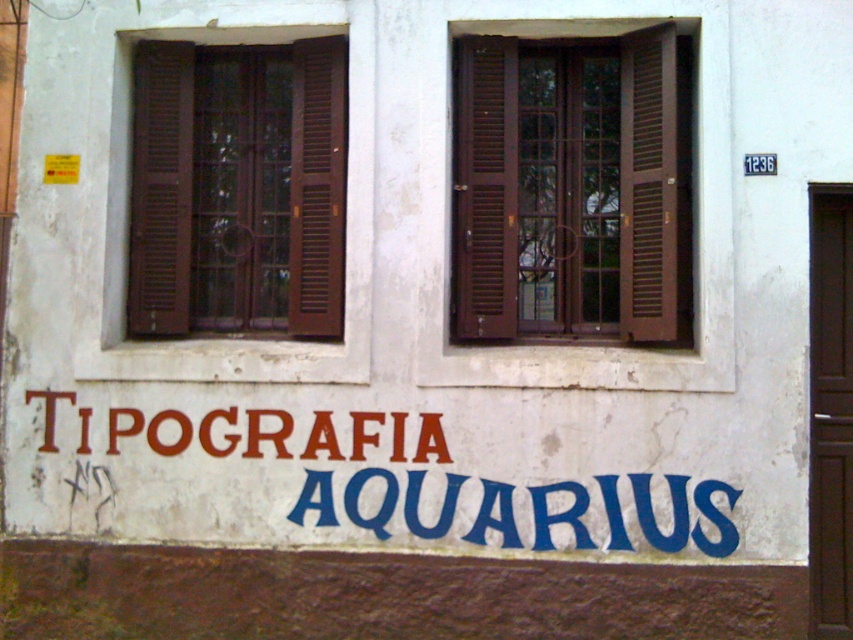
You are standing in front of the building and want to place a sticker on the wall. You have two points marked on your map as coordinates. The first point is at point (x=512, y=252) and the second is at point (x=608, y=496). If you want to place the sticker where it will be visible from the front without being blocked by the other point, which coordinate should you choose?

You should choose point (x=608, y=496) because point (x=512, y=252) is behind it and would block the view from the front.

From the picture: You are an architect inspecting the building facade. You need to determine if the brown wooden window at upper center can accommodate a larger security bar than the brown wooden window at left. Based on the visible shutters and bars, what can you infer?

The brown wooden window at upper center might be wider than the brown wooden window at left, so it could potentially accommodate a larger security bar.